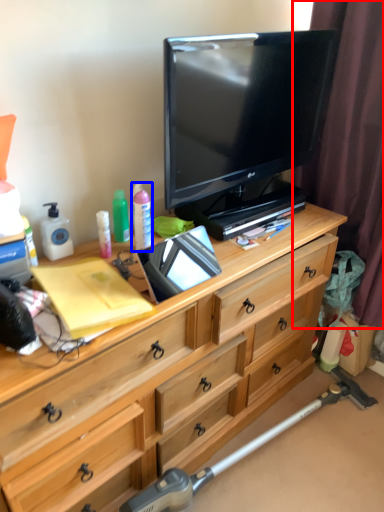
Question: Among these objects, which one is nearest to the camera, curtain (highlighted by a red box) or toiletry (highlighted by a blue box)?

Choices:
 (A) curtain
 (B) toiletry

Answer: (A)